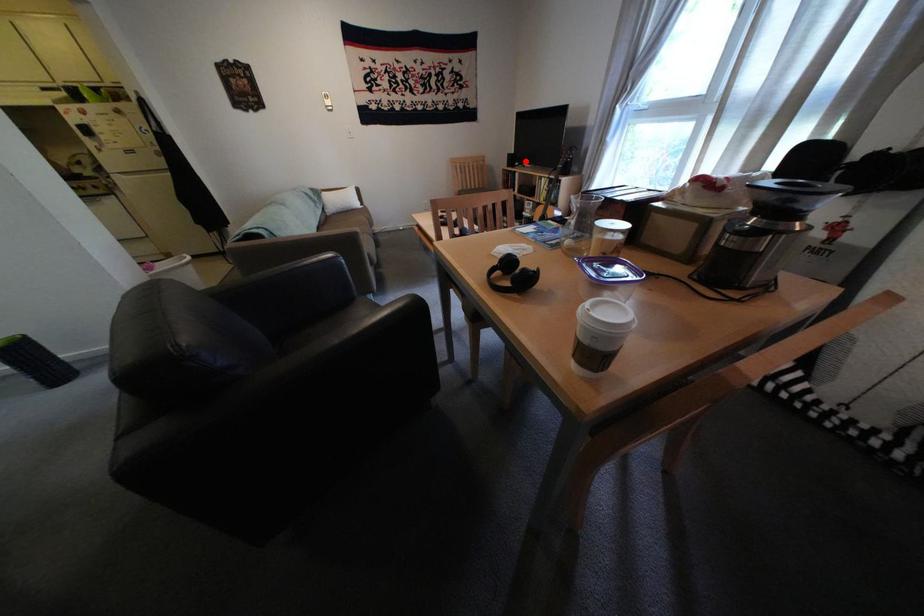
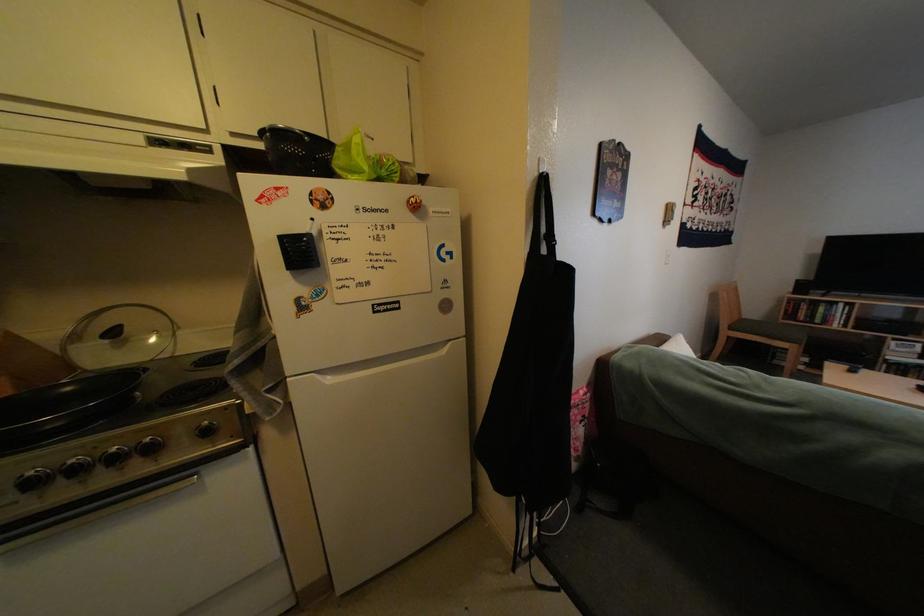
Question: I am providing you with two images of the same scene from different viewpoints. A red point is shown in image1. For the corresponding object point in image2, is it positioned nearer or farther from the camera?

Choices:
 (A) Nearer
 (B) Farther

Answer: (B)